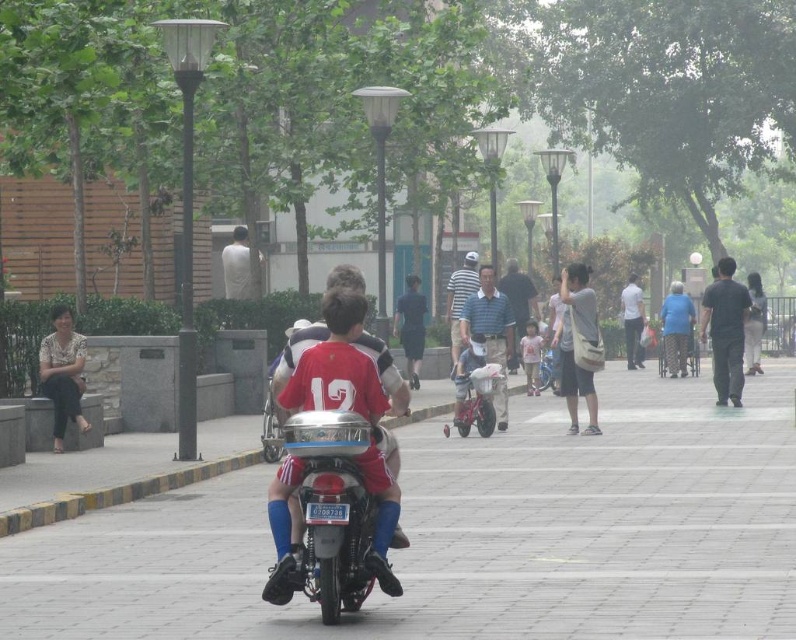
Question: Observing the image, what is the correct spatial positioning of dark blue fabric shirt at center in reference to striped cotton shirt at center?

Choices:
 (A) below
 (B) above

Answer: (A)

Question: Based on their relative distances, which object is farther from the striped polo shirt at center?

Choices:
 (A) matte gray bag at center
 (B) blue striped shirt at center

Answer: (B)

Question: Is smooth concrete pavement at center below matte gray bag at center?

Choices:
 (A) yes
 (B) no

Answer: (A)

Question: Estimate the real-world distances between objects in this image. Which object is farther from the metallic silver motorcycle at center?

Choices:
 (A) dark blue fabric shirt at center
 (B) dark gray pants at center
 (C) striped cotton shirt at center
 (D) blue fabric shirt at center-right

Answer: (D)

Question: Can you confirm if dark gray cotton pants at right is thinner than blue striped shirt at center?

Choices:
 (A) yes
 (B) no

Answer: (A)

Question: Which point is closer to the camera taking this photo?

Choices:
 (A) (498, 337)
 (B) (404, 296)
 (C) (740, 381)

Answer: (A)